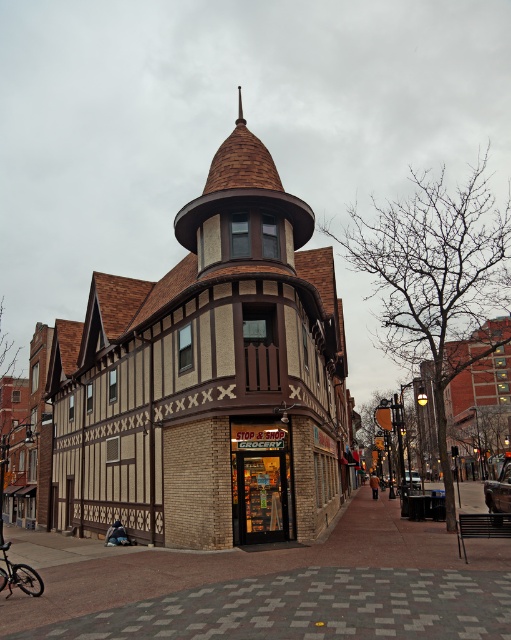
Is brown wood/brick tower at center bigger than matte glass storefront at center?

Yes.

This screenshot has height=640, width=511. Describe the element at coordinates (210, 378) in the screenshot. I see `brown wood/brick tower at center` at that location.

Locate an element on the screen. The width and height of the screenshot is (511, 640). brown wood/brick tower at center is located at coordinates (210, 378).

Between matte glass storefront at center and black matte bicycle at lower left, which one appears on the right side from the viewer's perspective?

From the viewer's perspective, matte glass storefront at center appears more on the right side.

Does matte glass storefront at center have a larger size compared to black matte bicycle at lower left?

Yes, matte glass storefront at center is bigger than black matte bicycle at lower left.

Does point (246, 481) come farther from viewer compared to point (33, 592)?

Yes, point (246, 481) is farther from viewer.

This screenshot has width=511, height=640. I want to click on matte glass storefront at center, so click(x=261, y=483).

Who is more forward, (299, 520) or (42, 589)?

Positioned in front is point (42, 589).

Does brown wood/brick tower at center appear under black matte bicycle at lower left?

Incorrect, brown wood/brick tower at center is not positioned below black matte bicycle at lower left.

Is point (131, 337) less distant than point (5, 544)?

No, it is not.

Locate an element on the screen. brown wood/brick tower at center is located at coordinates (210, 378).